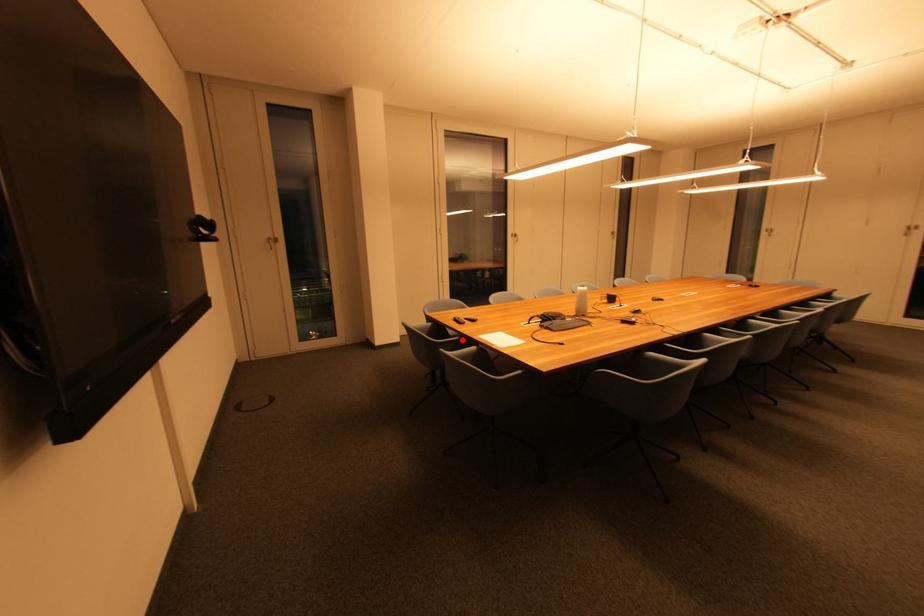
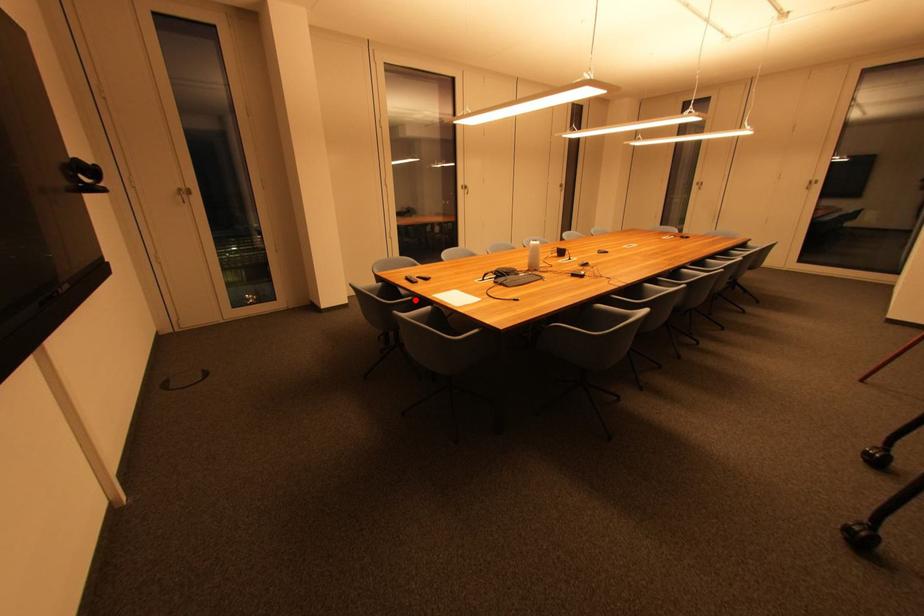
I am providing you with two images of the same scene from different viewpoints. A red point is marked on the first image and another point is marked on the second image. Does the point marked in image1 correspond to the same location as the one in image2?

Yes